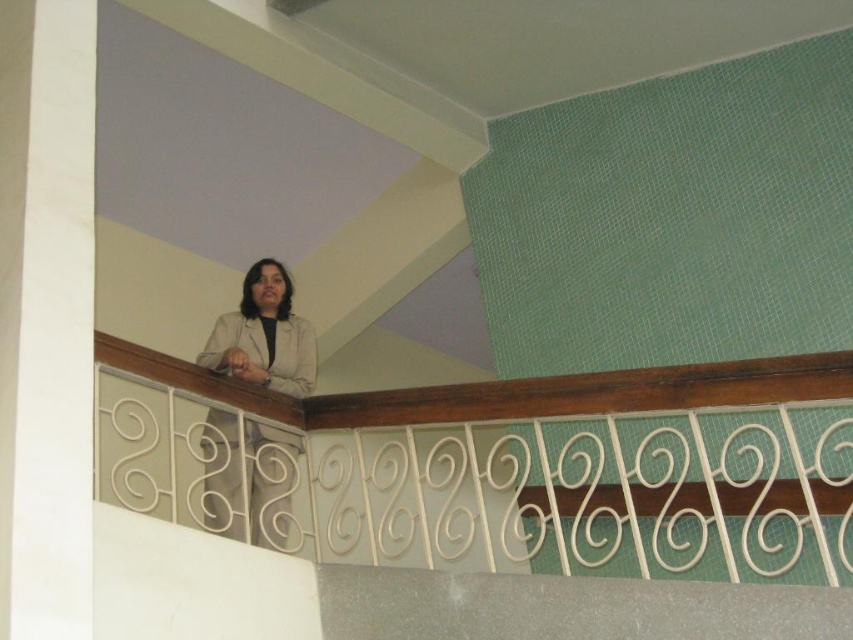
You are a fashion designer observing the matte beige jacket at upper center and the beige fabric lab coat at center in the image. Which piece of clothing appears taller in the scene?

The matte beige jacket at upper center appears much taller than the beige fabric lab coat at center in the scene.

You are an interior designer planning to place a decorative item exactly at the coordinates mentioned in the scene. Where should you place the item to avoid overlapping with the matte beige jacket at upper center?

The matte beige jacket at upper center is located at point (264, 336), so you should place the decorative item at a different coordinate to avoid overlapping with it.